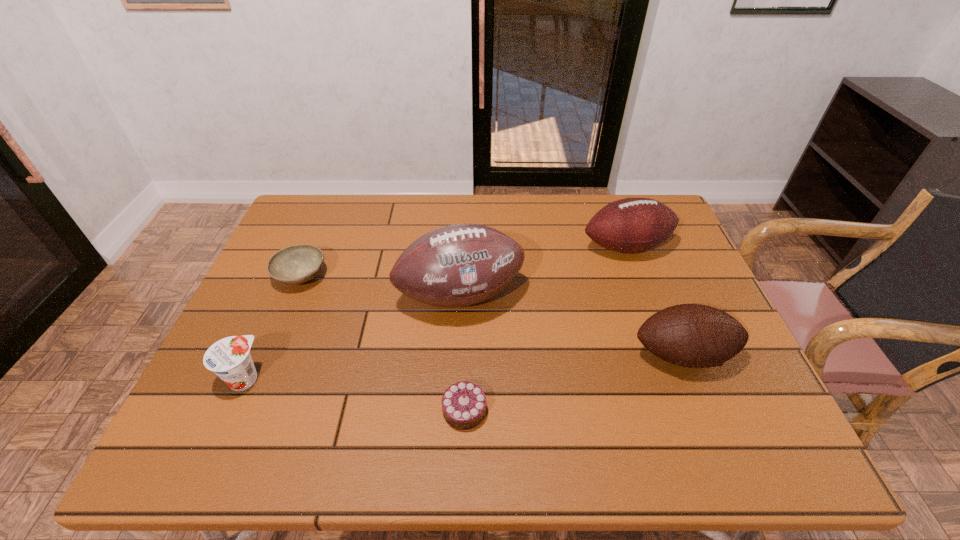
The height and width of the screenshot is (540, 960). I want to click on the leftmost football, so click(x=458, y=265).

You are a GUI agent. You are given a task and a screenshot of the screen. Output one action in this format:
    pyautogui.click(x=<x>, y=<y>)
    Task: Click on the second farthest football
    The image size is (960, 540).
    Given the screenshot: What is the action you would take?
    pyautogui.click(x=458, y=265)

Identify the location of the farthest football. This screenshot has width=960, height=540. [631, 225].

Where is `the nearest football`? the nearest football is located at coordinates (690, 335).

Identify the location of yogurt. The image size is (960, 540). click(x=229, y=358).

Find the location of `chocolate cake`. chocolate cake is located at coordinates (464, 403).

Identify the location of bowl. (297, 264).

You are a GUI agent. You are given a task and a screenshot of the screen. Output one action in this format:
    pyautogui.click(x=<x>, y=<y>)
    Task: Click on the free space located 0.060m on the left of the second farthest football
    The width and height of the screenshot is (960, 540).
    Given the screenshot: What is the action you would take?
    pyautogui.click(x=375, y=296)

This screenshot has width=960, height=540. I want to click on vacant area situated on the front of the farthest football, so click(x=659, y=335).

The width and height of the screenshot is (960, 540). Identify the location of vacant area situated 0.120m on the laces of the nearest football. (713, 431).